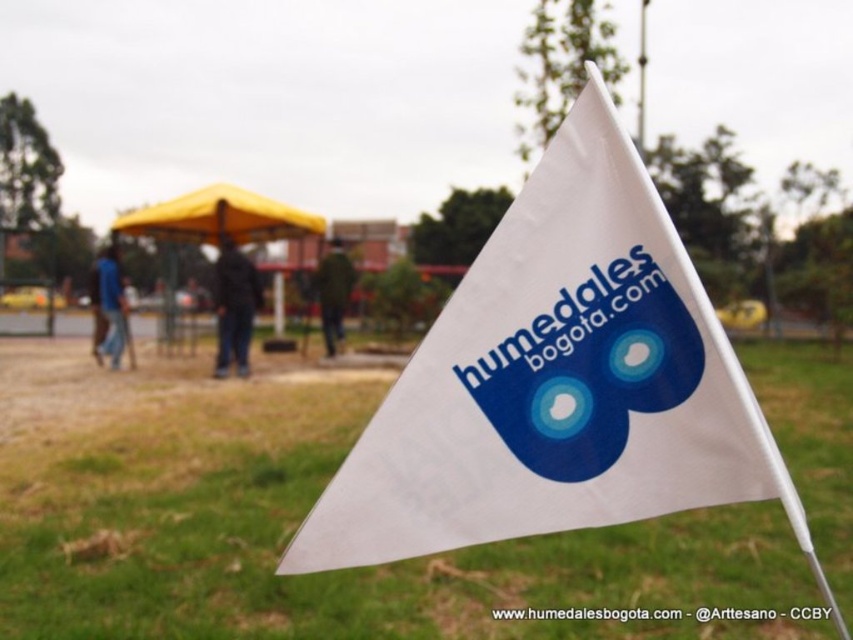
From the picture: Who is positioned more to the left, green grass at center or white plastic pole at upper center?

green grass at center

Which is in front, point (3, 538) or point (641, 83)?

Point (3, 538) is more forward.

Locate an element on the screen. The height and width of the screenshot is (640, 853). green grass at center is located at coordinates (300, 518).

Does white fabric flag at center appear on the left side of yellow fabric canopy at upper left?

Incorrect, white fabric flag at center is not on the left side of yellow fabric canopy at upper left.

Measure the distance between white fabric flag at center and yellow fabric canopy at upper left.

They are 4.45 meters apart.

Is point (675, 310) farther from camera compared to point (189, 234)?

No, (675, 310) is closer to viewer.

Find the location of a particular element. This screenshot has height=640, width=853. white fabric flag at center is located at coordinates (556, 380).

Which is more to the right, white fabric flag at center or white plastic pole at upper center?

white plastic pole at upper center

In the scene shown: Does white fabric flag at center appear over white plastic pole at upper center?

No, white fabric flag at center is not above white plastic pole at upper center.

Which is behind, point (746, 438) or point (637, 124)?

Point (637, 124)

This screenshot has height=640, width=853. I want to click on white fabric flag at center, so click(x=556, y=380).